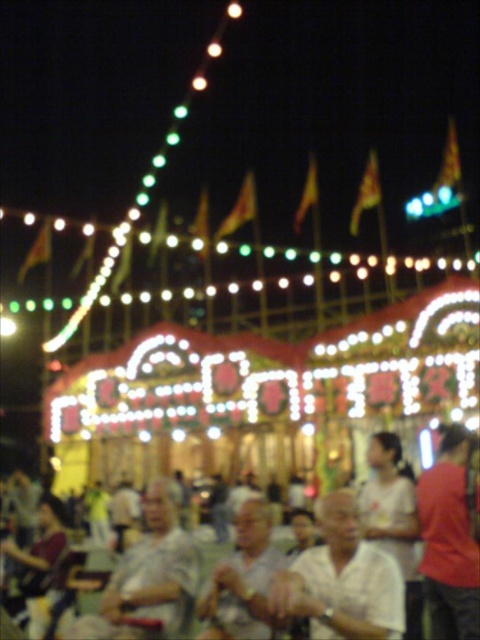
You are organizing a photo shoot and need to place two models wearing the gray fabric shirt at lower left and the red fabric shirt at right. The photographer wants to ensure that the wider shirt is positioned where it can be more easily seen. Based on the scene, which shirt should be placed in the foreground to emphasize its width?

The gray fabric shirt at lower left should be placed in the foreground because its width surpasses that of the red fabric shirt at right, making it more noticeable when closer to the viewer.

You are at the festive event and want to take a photo of both the white matte shirt at center and the white textured shirt at center. Since you can only focus on one at a time, which one should you choose to ensure the other is still somewhat in focus?

The white matte shirt at center is closer to the viewer than the white textured shirt at center. To ensure both are somewhat in focus, you should focus on the white matte shirt at center, as the depth of field will extend further back towards the white textured shirt at center.